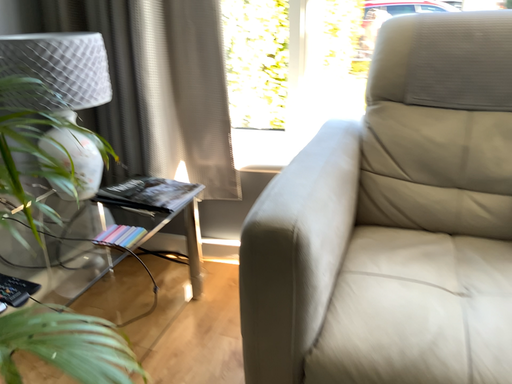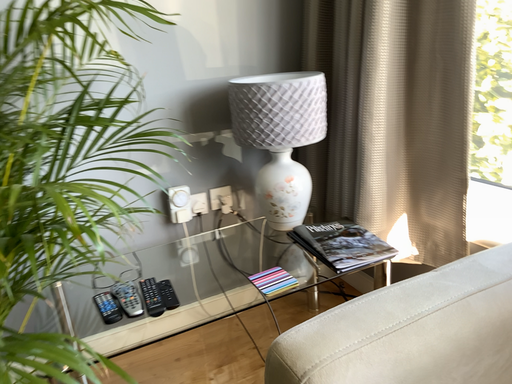
Question: How did the camera likely rotate when shooting the video?

Choices:
 (A) rotated downward
 (B) rotated upward

Answer: (B)